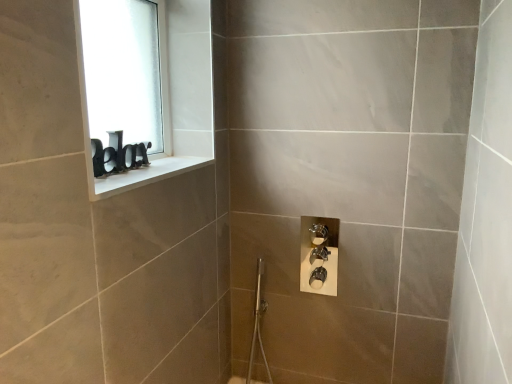
Question: Should I look upward or downward to see white frosted glass at upper left?

Choices:
 (A) up
 (B) down

Answer: (A)

Question: Considering the relative sizes of white frosted glass at upper left and white glossy window sill at upper left in the image provided, is white frosted glass at upper left thinner than white glossy window sill at upper left?

Choices:
 (A) no
 (B) yes

Answer: (B)

Question: Is white frosted glass at upper left oriented towards white glossy window sill at upper left?

Choices:
 (A) yes
 (B) no

Answer: (A)

Question: Can you confirm if white frosted glass at upper left is positioned to the left of white glossy window sill at upper left?

Choices:
 (A) no
 (B) yes

Answer: (B)

Question: From a real-world perspective, does white frosted glass at upper left stand above white glossy window sill at upper left?

Choices:
 (A) no
 (B) yes

Answer: (B)

Question: Considering the relative sizes of white frosted glass at upper left and white glossy window sill at upper left in the image provided, is white frosted glass at upper left smaller than white glossy window sill at upper left?

Choices:
 (A) yes
 (B) no

Answer: (B)

Question: Would you say white frosted glass at upper left is a long distance from white glossy window sill at upper left?

Choices:
 (A) no
 (B) yes

Answer: (A)

Question: From a real-world perspective, is white glossy window sill at upper left located higher than white frosted glass at upper left?

Choices:
 (A) yes
 (B) no

Answer: (B)

Question: Can you confirm if white glossy window sill at upper left is thinner than white frosted glass at upper left?

Choices:
 (A) no
 (B) yes

Answer: (A)

Question: Is white glossy window sill at upper left shorter than white frosted glass at upper left?

Choices:
 (A) no
 (B) yes

Answer: (B)

Question: Does white glossy window sill at upper left lie behind white frosted glass at upper left?

Choices:
 (A) no
 (B) yes

Answer: (A)

Question: Can you confirm if white glossy window sill at upper left is smaller than white frosted glass at upper left?

Choices:
 (A) yes
 (B) no

Answer: (A)

Question: From the image's perspective, is white glossy window sill at upper left above white frosted glass at upper left?

Choices:
 (A) yes
 (B) no

Answer: (B)

Question: From a real-world perspective, is white frosted glass at upper left physically located above or below white glossy window sill at upper left?

Choices:
 (A) below
 (B) above

Answer: (B)